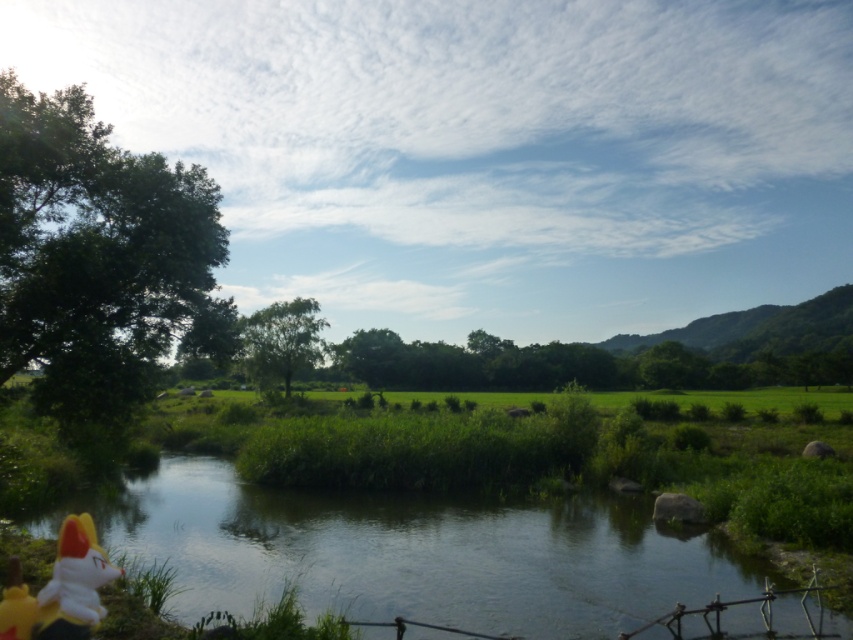
Question: Which point is closer to the camera?

Choices:
 (A) green leafy tree at left
 (B) green leafy tree at center
 (C) green grassy river at lower center

Answer: (A)

Question: Which object is closer to the camera taking this photo?

Choices:
 (A) green leafy tree at left
 (B) green leafy tree at center
 (C) green grassy river at lower center

Answer: (A)

Question: Is green leafy tree at left thinner than green leafy tree at center?

Choices:
 (A) yes
 (B) no

Answer: (B)

Question: Is green grassy river at lower center smaller than green leafy tree at left?

Choices:
 (A) yes
 (B) no

Answer: (A)

Question: Can you confirm if green grassy river at lower center is thinner than green leafy tree at left?

Choices:
 (A) yes
 (B) no

Answer: (B)

Question: Which point appears farthest from the camera in this image?

Choices:
 (A) (13, 276)
 (B) (251, 508)

Answer: (B)